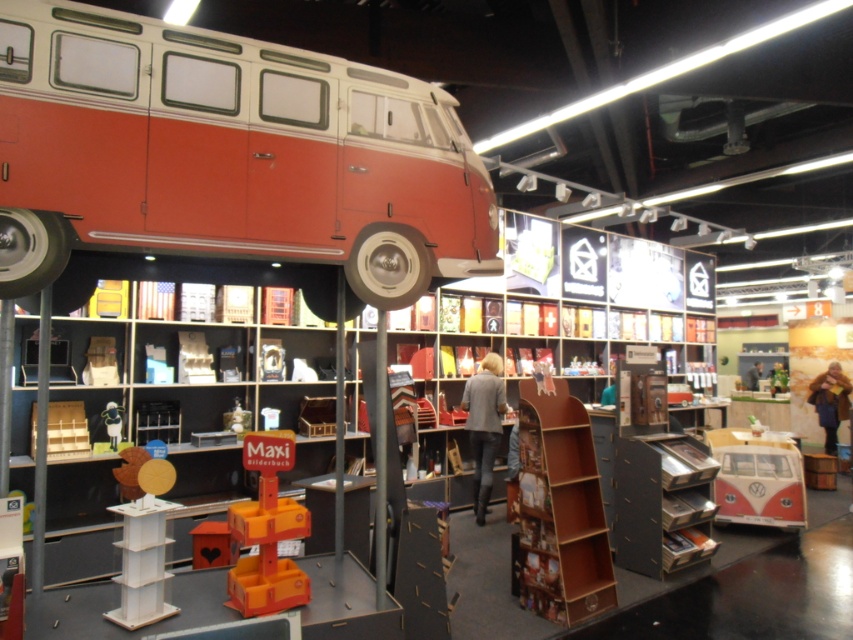
This screenshot has width=853, height=640. Find the location of `light gray fabric jacket at center`. light gray fabric jacket at center is located at coordinates (485, 426).

Which of these two, light gray fabric jacket at center or leather jacket at lower right, stands taller?

light gray fabric jacket at center is taller.

Between point (500, 400) and point (811, 397), which one is positioned behind?

Positioned behind is point (811, 397).

This screenshot has width=853, height=640. I want to click on light gray fabric jacket at center, so click(x=485, y=426).

From the picture: Between matte red van at upper center and leather jacket at lower right, which one appears on the left side from the viewer's perspective?

Positioned to the left is matte red van at upper center.

Who is lower down, matte red van at upper center or leather jacket at lower right?

leather jacket at lower right is below.

Does point (264, 100) come behind point (834, 429)?

That is False.

You are a GUI agent. You are given a task and a screenshot of the screen. Output one action in this format:
    pyautogui.click(x=<x>, y=<y>)
    Task: Click on the matte red van at upper center
    This screenshot has height=640, width=853.
    Given the screenshot: What is the action you would take?
    point(227,156)

Is wooden at center above light gray fabric jacket at center?

Yes.

Between point (548, 456) and point (498, 392), which one is positioned behind?

The point (498, 392) is more distant.

Is point (595, 477) positioned behind point (491, 355)?

No, (595, 477) is in front of (491, 355).

Find the location of a particular element. The height and width of the screenshot is (640, 853). wooden at center is located at coordinates (560, 509).